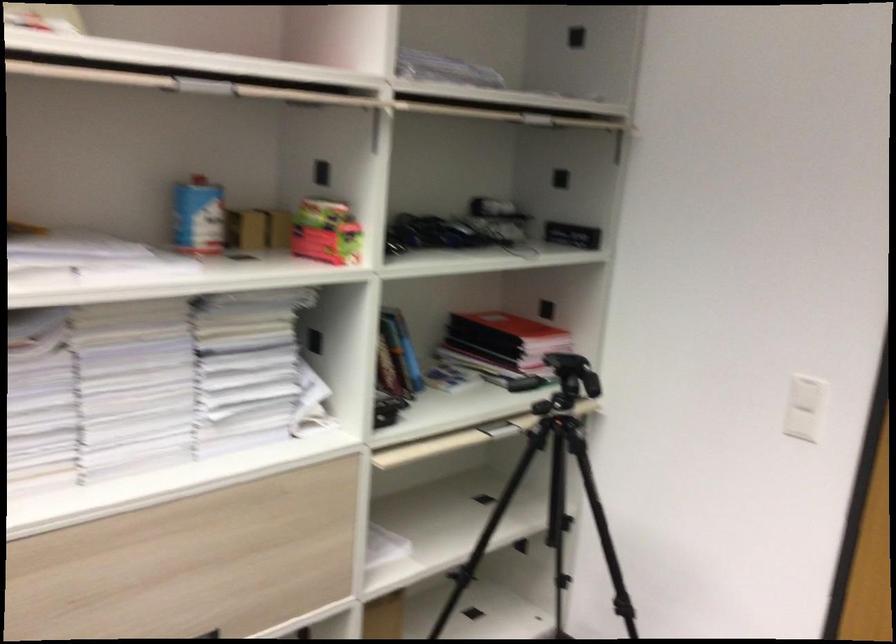
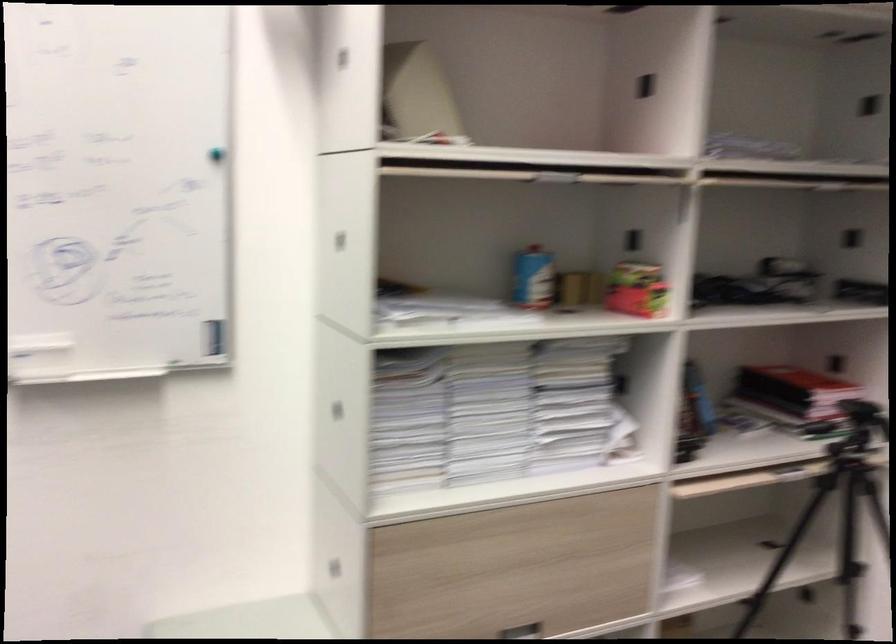
The point at [200,220] is marked in the first image. Where is the corresponding point in the second image?

(532, 278)